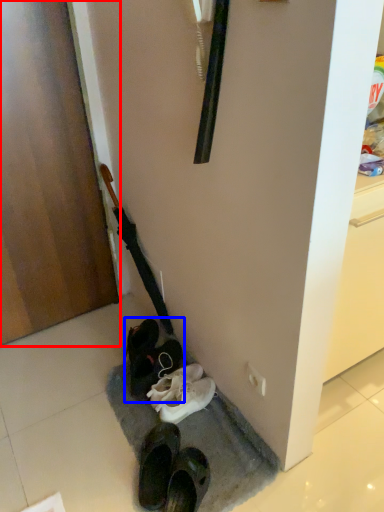
Question: Among these objects, which one is nearest to the camera, door (highlighted by a red box) or footwear (highlighted by a blue box)?

Choices:
 (A) door
 (B) footwear

Answer: (A)